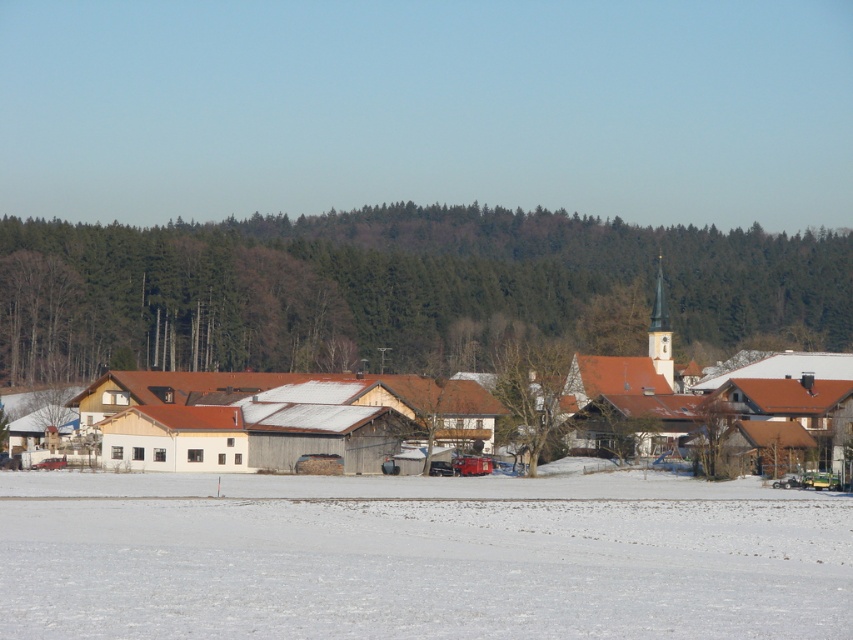
Question: Does white powdery snow at lower center lie behind white wooden houses at center?

Choices:
 (A) no
 (B) yes

Answer: (A)

Question: Which is farther from the brown wooden tree at center?

Choices:
 (A) green leafy trees at center
 (B) white powdery snow at lower center
 (C) white wooden houses at center

Answer: (A)

Question: Can you confirm if white wooden houses at center is wider than brown wooden tree at center?

Choices:
 (A) no
 (B) yes

Answer: (B)

Question: From the image, what is the correct spatial relationship of green leafy trees at center in relation to brown wooden tree at center?

Choices:
 (A) right
 (B) left

Answer: (B)

Question: Based on their relative distances, which object is farther from the white wooden houses at center?

Choices:
 (A) white powdery snow at lower center
 (B) brown wooden tree at center

Answer: (A)

Question: Which of the following is the closest to the observer?

Choices:
 (A) (172, 346)
 (B) (161, 500)
 (C) (622, 344)

Answer: (B)